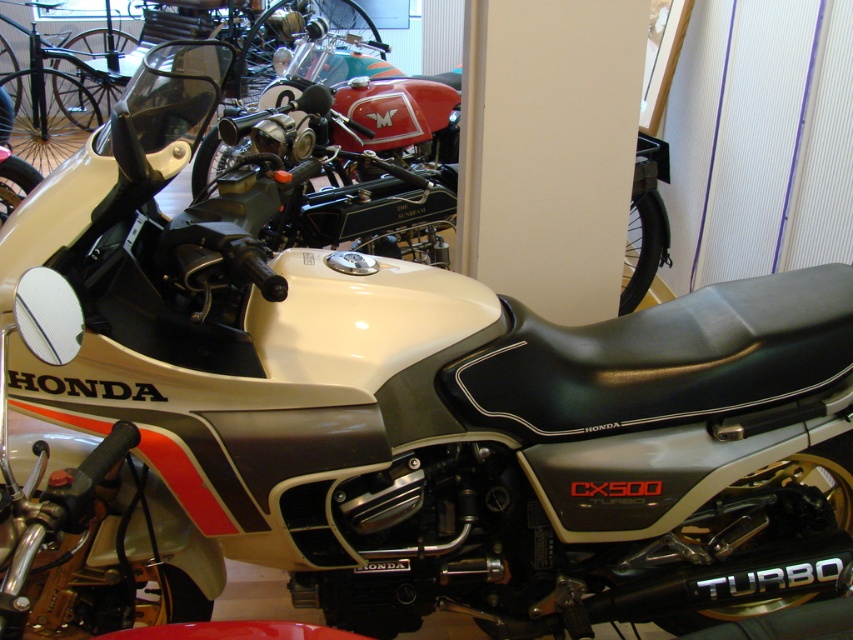
You are a delivery person who needs to move a 24 inch wide box through the space between the white matte pillar at center and the matte black motorcycle at center. Can you fit the box through that space?

The distance between the white matte pillar at center and the matte black motorcycle at center is 23.79 inches. Since the box is 24 inches wide, it is slightly wider than the available space. Therefore, the box cannot fit through the space between them.

You are a photographer setting up a shoot in a studio with a white matte pillar at center and a matte black motorcycle at center. You need to position a backdrop that is 2 meters wide. Will the backdrop be wide enough to cover both objects without any overlap?

The white matte pillar at center has a lesser width compared to matte black motorcycle at center. Since the backdrop is 2 meters wide, it depends on the combined width of both objects. However, the description only provides a comparison between their widths, not their exact measurements. Without knowing the exact width of either object, it is impossible to determine if the backdrop will be sufficient.

You are standing in a showroom and want to take a photo of the matte black motorcycle at center. However, there is a white matte pillar at center in the way. Can you move around to get a clear shot without the pillar blocking the motorcycle?

The white matte pillar at center is further to the viewer than the matte black motorcycle at center, so moving to the side would allow you to position yourself so the motorcycle is no longer behind the pillar.